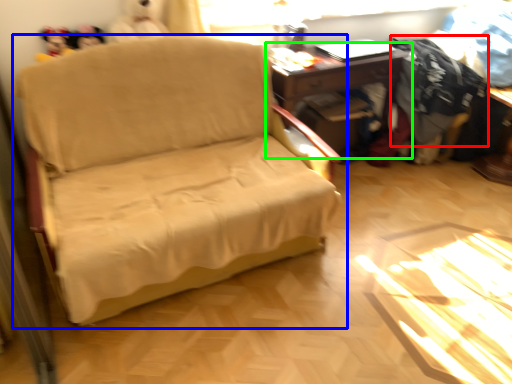
Question: Which object is positioned closest to clothing (highlighted by a red box)? Select from studio couch (highlighted by a blue box) and table (highlighted by a green box).

Choices:
 (A) studio couch
 (B) table

Answer: (B)